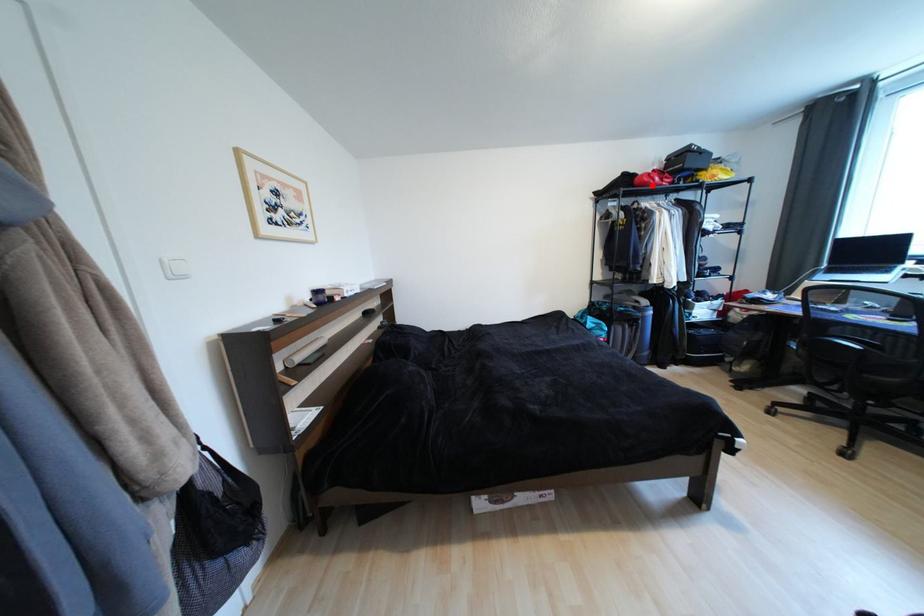
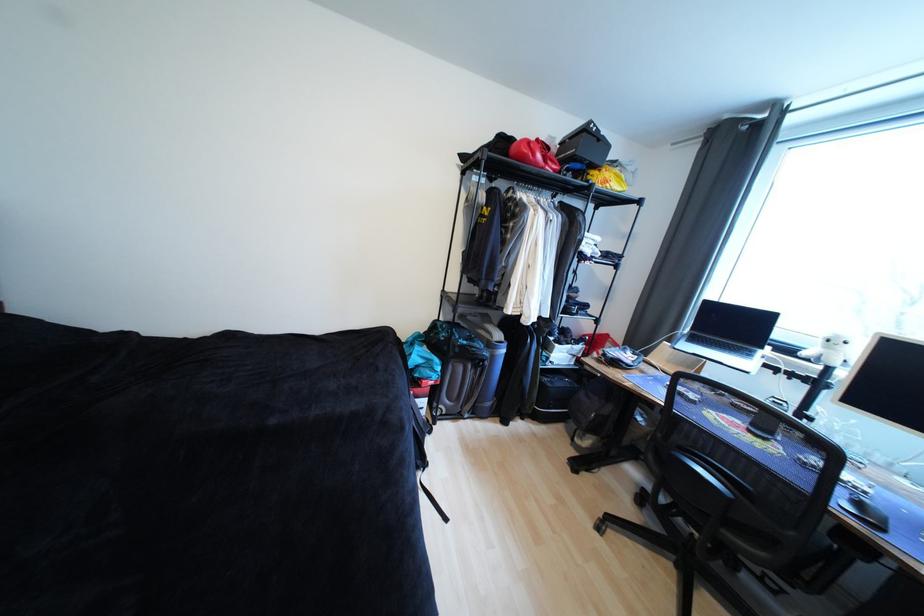
Find the pixel in the second image that matches the highlighted location in the first image.

(529, 159)